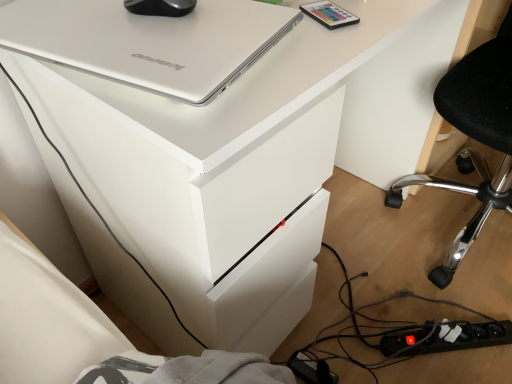
Question: Considering the relative sizes of black plastic chair at lower right and black plastic power strip at lower right in the image provided, is black plastic chair at lower right bigger than black plastic power strip at lower right?

Choices:
 (A) yes
 (B) no

Answer: (A)

Question: Can you confirm if black plastic chair at lower right is thinner than black plastic power strip at lower right?

Choices:
 (A) yes
 (B) no

Answer: (B)

Question: Is black plastic chair at lower right further to the viewer compared to black plastic power strip at lower right?

Choices:
 (A) no
 (B) yes

Answer: (A)

Question: Is black plastic chair at lower right beside black plastic power strip at lower right?

Choices:
 (A) no
 (B) yes

Answer: (A)

Question: From the image's perspective, is black plastic chair at lower right beneath black plastic power strip at lower right?

Choices:
 (A) no
 (B) yes

Answer: (A)

Question: Is black plastic chair at lower right smaller than black plastic power strip at lower right?

Choices:
 (A) no
 (B) yes

Answer: (A)

Question: Can you confirm if matte plastic remote control at upper right is positioned to the right of black rubberized mouse at upper center?

Choices:
 (A) no
 (B) yes

Answer: (B)

Question: From a real-world perspective, is matte plastic remote control at upper right physically below black rubberized mouse at upper center?

Choices:
 (A) no
 (B) yes

Answer: (B)

Question: Can you confirm if matte plastic remote control at upper right is smaller than black rubberized mouse at upper center?

Choices:
 (A) no
 (B) yes

Answer: (B)

Question: Can you confirm if matte plastic remote control at upper right is taller than black rubberized mouse at upper center?

Choices:
 (A) yes
 (B) no

Answer: (B)

Question: Does matte plastic remote control at upper right lie behind black rubberized mouse at upper center?

Choices:
 (A) no
 (B) yes

Answer: (B)

Question: Can you confirm if matte plastic remote control at upper right is wider than black rubberized mouse at upper center?

Choices:
 (A) no
 (B) yes

Answer: (A)

Question: Is matte plastic remote control at upper right beside black plastic chair at lower right?

Choices:
 (A) no
 (B) yes

Answer: (A)